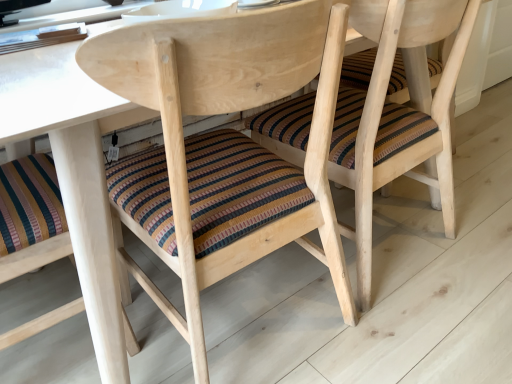
Question: Can you confirm if striped fabric cushion at center, marked as the first chair in a left-to-right arrangement, is bigger than striped fabric cushion at center, the 2th chair in the left-to-right sequence?

Choices:
 (A) yes
 (B) no

Answer: (A)

Question: Does striped fabric cushion at center, which ranks as the second chair in right-to-left order, turn towards striped fabric cushion at center, the 2th chair in the left-to-right sequence?

Choices:
 (A) no
 (B) yes

Answer: (A)

Question: Is striped fabric cushion at center, marked as the first chair in a left-to-right arrangement, at the right side of striped fabric cushion at center, the 2th chair in the left-to-right sequence?

Choices:
 (A) no
 (B) yes

Answer: (A)

Question: Can you confirm if striped fabric cushion at center, which ranks as the second chair in right-to-left order, is positioned to the left of striped fabric cushion at center, the 2th chair in the left-to-right sequence?

Choices:
 (A) yes
 (B) no

Answer: (A)

Question: Is striped fabric cushion at center, marked as the first chair in a left-to-right arrangement, oriented away from striped fabric cushion at center, placed as the 1th chair when sorted from right to left?

Choices:
 (A) no
 (B) yes

Answer: (A)

Question: From the image's perspective, is striped fabric cushion at center, which ranks as the second chair in right-to-left order, located beneath striped fabric cushion at center, placed as the 1th chair when sorted from right to left?

Choices:
 (A) yes
 (B) no

Answer: (A)

Question: From the image's perspective, is striped fabric cushion at center, placed as the 1th chair when sorted from right to left, on top of striped fabric cushion at center, marked as the first chair in a left-to-right arrangement?

Choices:
 (A) yes
 (B) no

Answer: (A)

Question: Is striped fabric cushion at center, placed as the 1th chair when sorted from right to left, not near striped fabric cushion at center, which ranks as the second chair in right-to-left order?

Choices:
 (A) no
 (B) yes

Answer: (A)

Question: Does striped fabric cushion at center, placed as the 1th chair when sorted from right to left, lie behind striped fabric cushion at center, which ranks as the second chair in right-to-left order?

Choices:
 (A) yes
 (B) no

Answer: (A)

Question: Considering the relative positions of striped fabric cushion at center, placed as the 1th chair when sorted from right to left, and striped fabric cushion at center, marked as the first chair in a left-to-right arrangement, in the image provided, is striped fabric cushion at center, placed as the 1th chair when sorted from right to left, to the left of striped fabric cushion at center, marked as the first chair in a left-to-right arrangement, from the viewer's perspective?

Choices:
 (A) yes
 (B) no

Answer: (B)

Question: Does striped fabric cushion at center, placed as the 1th chair when sorted from right to left, have a lesser height compared to striped fabric cushion at center, which ranks as the second chair in right-to-left order?

Choices:
 (A) no
 (B) yes

Answer: (B)

Question: Is striped fabric cushion at center, placed as the 1th chair when sorted from right to left, turned away from striped fabric cushion at center, marked as the first chair in a left-to-right arrangement?

Choices:
 (A) no
 (B) yes

Answer: (A)

Question: Is striped fabric cushion at center, which ranks as the second chair in right-to-left order, bigger or smaller than striped fabric cushion at center, placed as the 1th chair when sorted from right to left?

Choices:
 (A) big
 (B) small

Answer: (A)